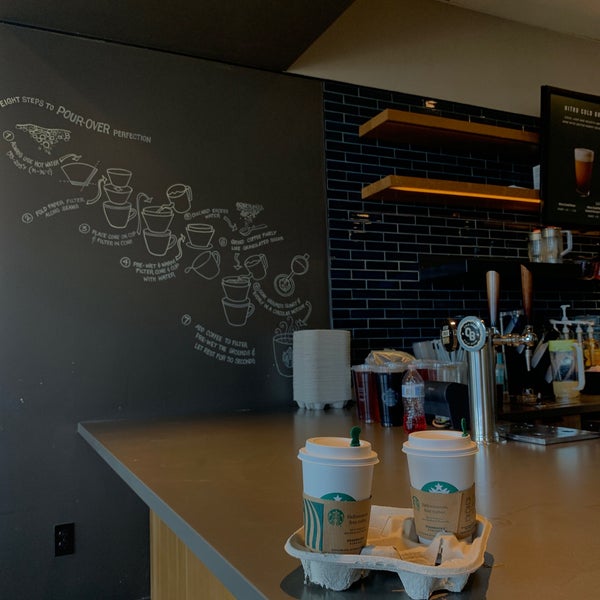
Image resolution: width=600 pixels, height=600 pixels. I want to click on coffee machine, so click(x=519, y=341).